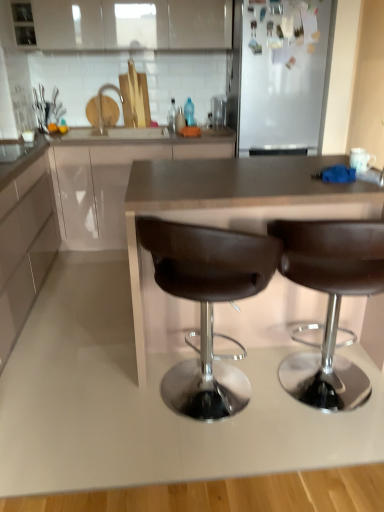
Question: Would you say white glossy cabinet at upper center, which is the first cabinetry in top-to-bottom order, is inside or outside matte white cabinet at center, positioned as the 2th cabinetry in bottom-to-top order?

Choices:
 (A) outside
 (B) inside

Answer: (A)

Question: Considering the positions of white glossy cabinet at upper center, which is the first cabinetry in top-to-bottom order, and matte white cabinet at center, positioned as the 2th cabinetry in bottom-to-top order, in the image, is white glossy cabinet at upper center, which is the first cabinetry in top-to-bottom order, wider or thinner than matte white cabinet at center, positioned as the 2th cabinetry in bottom-to-top order,?

Choices:
 (A) wide
 (B) thin

Answer: (B)

Question: Estimate the real-world distances between objects in this image. Which object is farther from the brushed metal faucet at upper center?

Choices:
 (A) white glossy cabinet at left, acting as the 1th cabinetry starting from the bottom
 (B) matte white cabinet at center, placed as the 2th cabinetry when sorted from top to bottom
 (C) brown leather stool at center, acting as the 2th chair starting from the left
 (D) brown leather stool at center, the 2th chair when ordered from right to left
 (E) brown leather countertop at center

Answer: (C)

Question: Which of these objects is positioned closest to the brown leather stool at center, the 2th chair when ordered from right to left?

Choices:
 (A) brushed metal faucet at upper center
 (B) brown leather countertop at center
 (C) matte white cabinet at center, placed as the 2th cabinetry when sorted from top to bottom
 (D) white glossy cabinet at upper center, which is the first cabinetry in top-to-bottom order
 (E) brown leather stool at center, acting as the 2th chair starting from the left

Answer: (E)